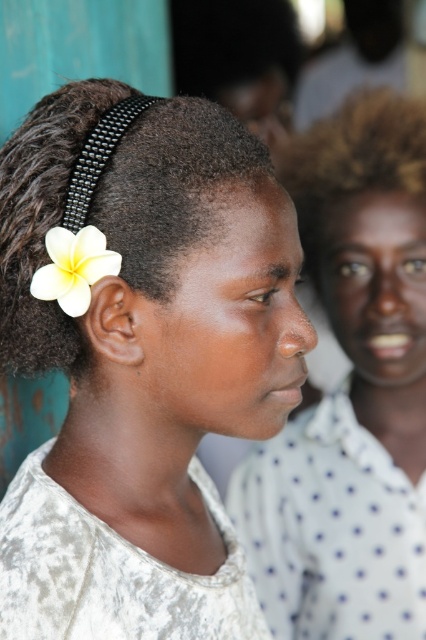
Is white matte flower at upper left bigger than matte white shirt at center?

No, white matte flower at upper left is not bigger than matte white shirt at center.

The width and height of the screenshot is (426, 640). I want to click on white matte flower at upper left, so click(141, 358).

Find the location of a particular element. The image size is (426, 640). white matte flower at upper left is located at coordinates 141,358.

The height and width of the screenshot is (640, 426). What do you see at coordinates (141, 358) in the screenshot?
I see `white matte flower at upper left` at bounding box center [141, 358].

Is white matte flower at upper left smaller than black beaded headband at left?

Incorrect, white matte flower at upper left is not smaller in size than black beaded headband at left.

Between point (28, 195) and point (203, 211), which one is positioned behind?

The point (28, 195) is behind.

Image resolution: width=426 pixels, height=640 pixels. Find the location of `white matte flower at upper left`. white matte flower at upper left is located at coordinates (141, 358).

Is point (402, 456) closer to viewer compared to point (81, 236)?

No, it is not.

Looking at this image, who is positioned more to the left, matte white shirt at center or white matte flower at left?

Positioned to the left is white matte flower at left.

This screenshot has width=426, height=640. What are the coordinates of `matte white shirt at center` in the screenshot? It's located at (351, 392).

Locate an element on the screen. The width and height of the screenshot is (426, 640). matte white shirt at center is located at coordinates (351, 392).